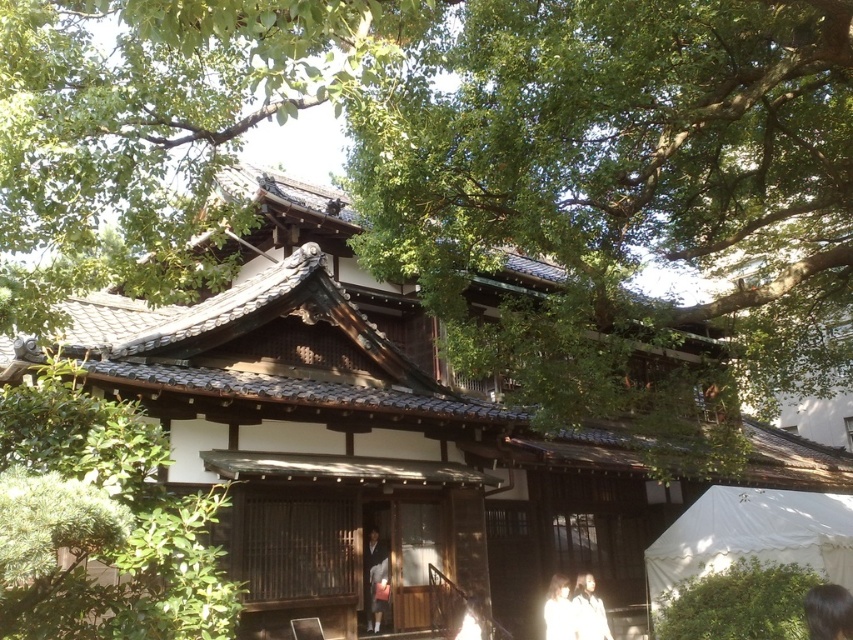
Is dark brown hair at lower right taller than white cotton shirt at lower center?

Yes, dark brown hair at lower right is taller than white cotton shirt at lower center.

Is point (810, 605) farther from camera compared to point (480, 621)?

No.

I want to click on dark brown hair at lower right, so tap(828, 611).

Who is shorter, green leafy tree at center or white canvas canopy at lower right?

Standing shorter between the two is white canvas canopy at lower right.

Find the location of a particular element. green leafy tree at center is located at coordinates (627, 204).

At what (x,y) coordinates should I click in order to perform the action: click on green leafy tree at center. Please return your answer as a coordinate pair (x, y). Image resolution: width=853 pixels, height=640 pixels. Looking at the image, I should click on (627, 204).

Can you confirm if green leafy tree at center is smaller than matte black kimono at center?

No.

Between green leafy tree at center and matte black kimono at center, which one has less height?

matte black kimono at center is shorter.

Image resolution: width=853 pixels, height=640 pixels. Describe the element at coordinates (627, 204) in the screenshot. I see `green leafy tree at center` at that location.

Where is `green leafy tree at center`? Image resolution: width=853 pixels, height=640 pixels. green leafy tree at center is located at coordinates (627, 204).